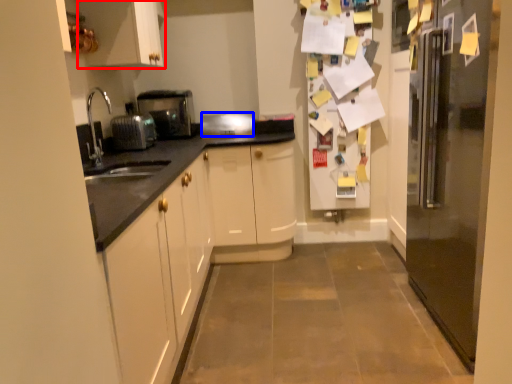
Question: Which object is further to the camera taking this photo, cabinetry (highlighted by a red box) or appliance (highlighted by a blue box)?

Choices:
 (A) cabinetry
 (B) appliance

Answer: (B)